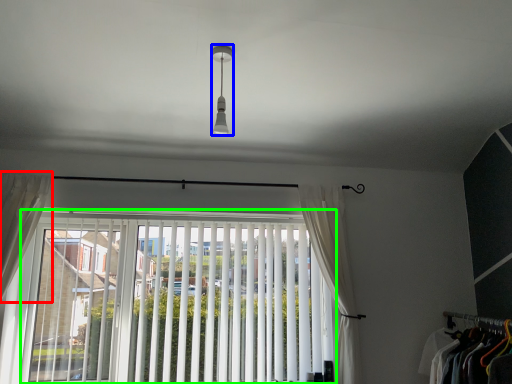
Question: Based on their relative distances, which object is nearer to curtain (highlighted by a red box)? Choose from light fixture (highlighted by a blue box) and window (highlighted by a green box).

Choices:
 (A) light fixture
 (B) window

Answer: (B)